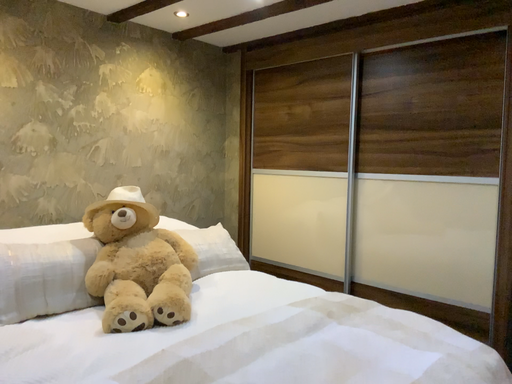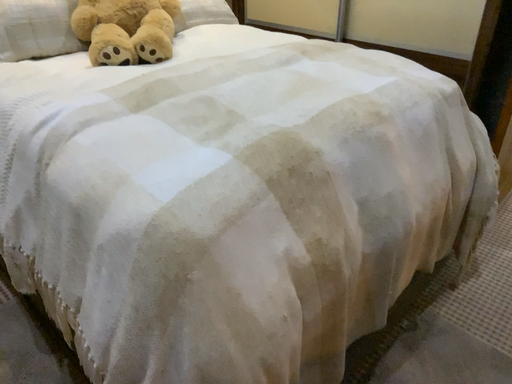
Question: How did the camera likely rotate when shooting the video?

Choices:
 (A) rotated upward
 (B) rotated downward

Answer: (B)